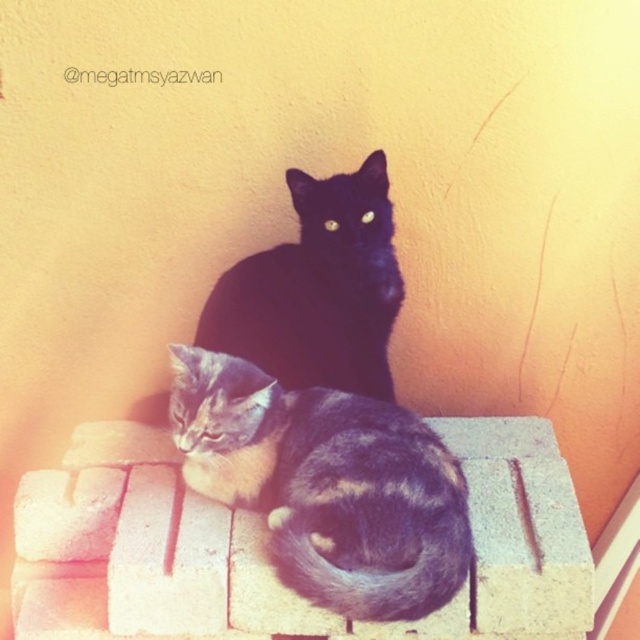
Is cement block at center to the right of black fur cat at center from the viewer's perspective?

Incorrect, cement block at center is not on the right side of black fur cat at center.

Is cement block at center smaller than black fur cat at center?

Actually, cement block at center might be larger than black fur cat at center.

This screenshot has height=640, width=640. I want to click on cement block at center, so click(x=266, y=538).

You are a GUI agent. You are given a task and a screenshot of the screen. Output one action in this format:
    pyautogui.click(x=<x>, y=<y>)
    Task: Click on the gray striped cat at center
    The height and width of the screenshot is (640, 640).
    Given the screenshot: What is the action you would take?
    pyautogui.click(x=326, y=484)

Between point (428, 556) and point (369, 387), which one is positioned in front?

Point (428, 556) is in front.

Which is behind, point (225, 444) or point (337, 348)?

The point (337, 348) is behind.

Locate an element on the screen. gray striped cat at center is located at coordinates (326, 484).

Is cement block at center smaller than gray striped cat at center?

No.

The image size is (640, 640). Describe the element at coordinates (266, 538) in the screenshot. I see `cement block at center` at that location.

Measure the distance between cement block at center and camera.

A distance of 1.61 meters exists between cement block at center and camera.

You are a GUI agent. You are given a task and a screenshot of the screen. Output one action in this format:
    pyautogui.click(x=<x>, y=<y>)
    Task: Click on the cement block at center
    
    Given the screenshot: What is the action you would take?
    (x=266, y=538)